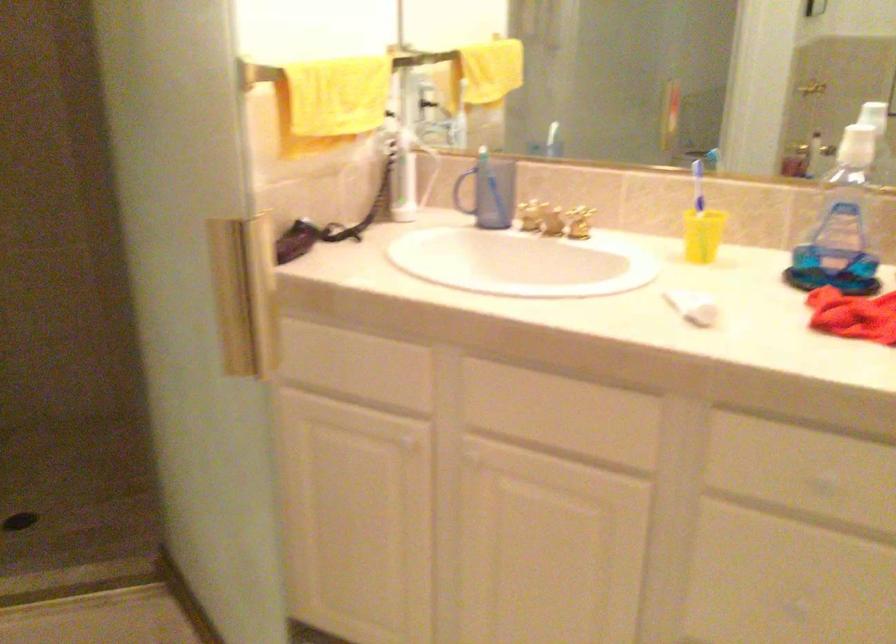
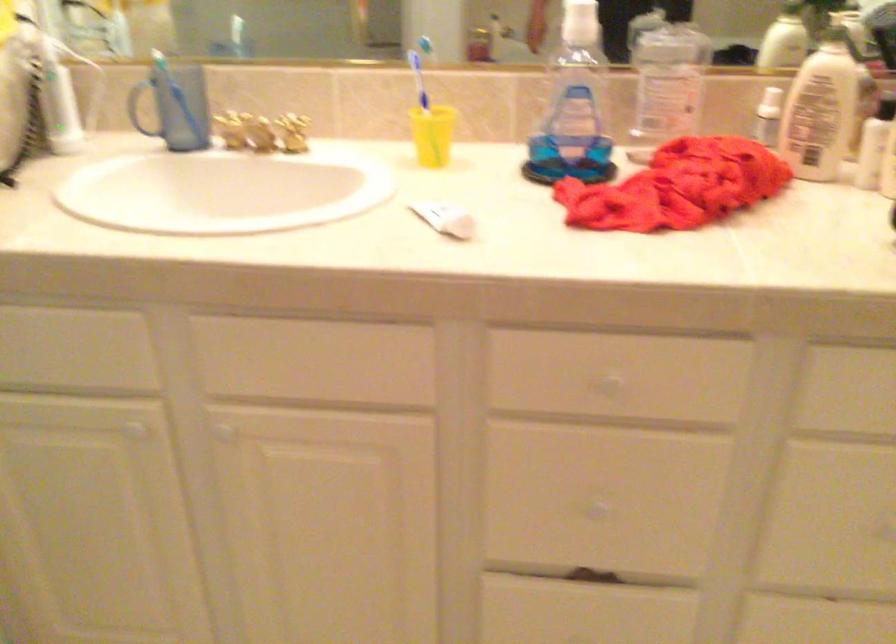
Find the pixel in the second image that matches [392,133] in the first image.

(39, 41)